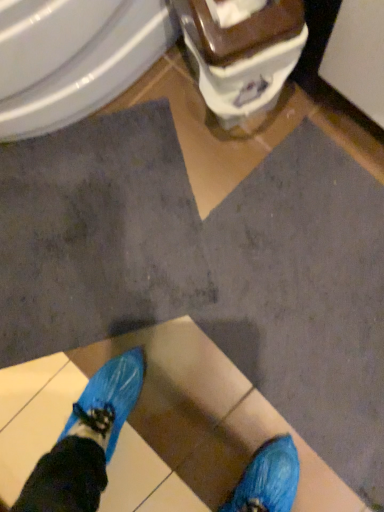
Question: From the image's perspective, is white glossy bidet at upper left on brown glossy toilet at upper center?

Choices:
 (A) yes
 (B) no

Answer: (A)

Question: Is white glossy bidet at upper left to the right of brown glossy toilet at upper center from the viewer's perspective?

Choices:
 (A) no
 (B) yes

Answer: (A)

Question: Would you say white glossy bidet at upper left is outside brown glossy toilet at upper center?

Choices:
 (A) yes
 (B) no

Answer: (A)

Question: From the image's perspective, does white glossy bidet at upper left appear lower than brown glossy toilet at upper center?

Choices:
 (A) yes
 (B) no

Answer: (B)

Question: Could you tell me if white glossy bidet at upper left is facing brown glossy toilet at upper center?

Choices:
 (A) yes
 (B) no

Answer: (A)

Question: Could brown glossy toilet at upper center be considered to be inside white glossy bidet at upper left?

Choices:
 (A) yes
 (B) no

Answer: (B)

Question: Is brown glossy toilet at upper center taller than white glossy bidet at upper left?

Choices:
 (A) no
 (B) yes

Answer: (A)

Question: From a real-world perspective, is brown glossy toilet at upper center under white glossy bidet at upper left?

Choices:
 (A) no
 (B) yes

Answer: (B)

Question: From a real-world perspective, is brown glossy toilet at upper center located higher than white glossy bidet at upper left?

Choices:
 (A) no
 (B) yes

Answer: (A)

Question: Is brown glossy toilet at upper center not within white glossy bidet at upper left?

Choices:
 (A) yes
 (B) no

Answer: (A)

Question: Would you consider brown glossy toilet at upper center to be distant from white glossy bidet at upper left?

Choices:
 (A) no
 (B) yes

Answer: (A)

Question: Is brown glossy toilet at upper center facing towards white glossy bidet at upper left?

Choices:
 (A) yes
 (B) no

Answer: (A)

Question: In terms of height, does brown glossy toilet at upper center look taller or shorter compared to white glossy bidet at upper left?

Choices:
 (A) tall
 (B) short

Answer: (B)